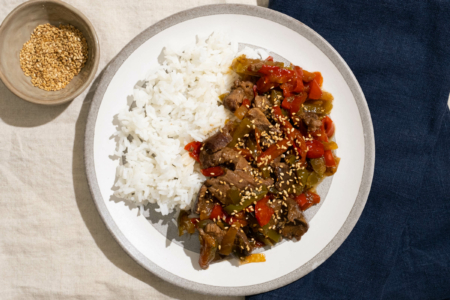
Where is `plate`? plate is located at coordinates (96, 166).